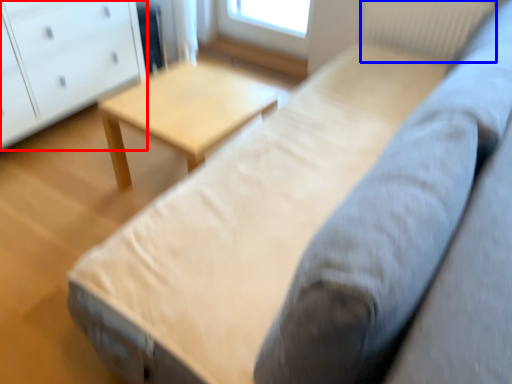
Question: Which of the following is the closest to the observer, chest of drawers (highlighted by a red box) or radiator (highlighted by a blue box)?

Choices:
 (A) chest of drawers
 (B) radiator

Answer: (A)